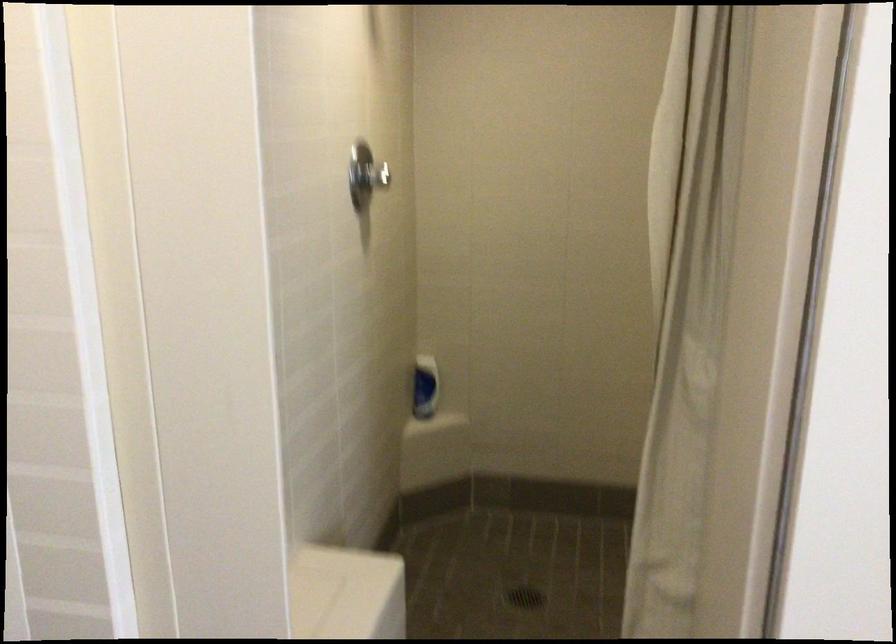
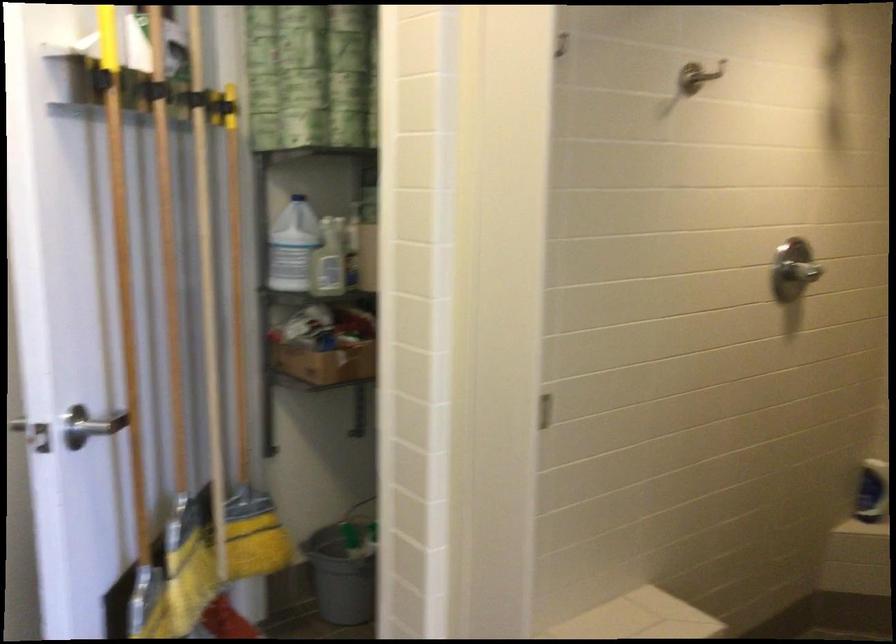
Locate, in the second image, the point that corresponds to [364,185] in the first image.

(793, 270)